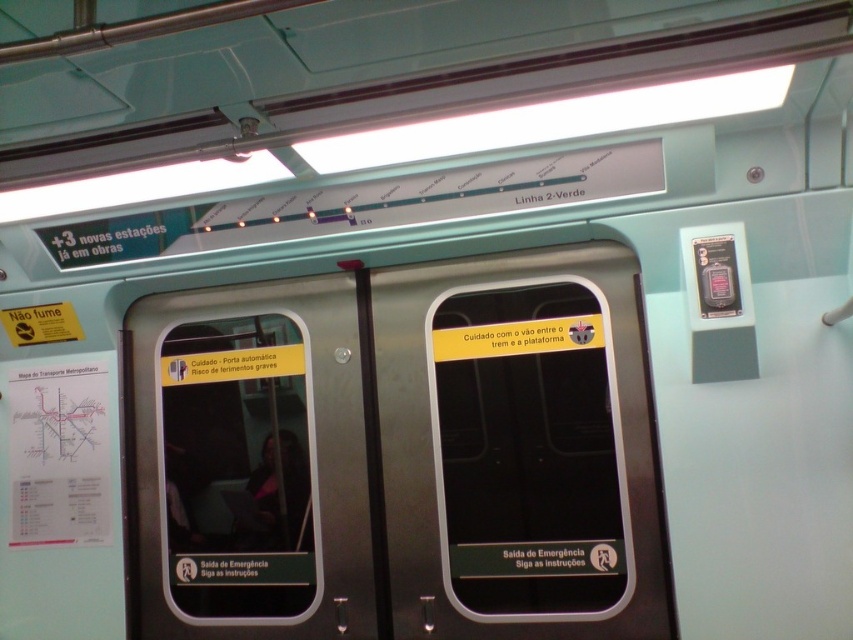
Question: Where is metallic silver emergency exit door at center located in relation to metallic silver door at center in the image?

Choices:
 (A) right
 (B) left

Answer: (A)

Question: Does metallic silver emergency exit door at center appear on the left side of metallic silver door at center?

Choices:
 (A) yes
 (B) no

Answer: (B)

Question: Among these points, which one is nearest to the camera?

Choices:
 (A) (601, 465)
 (B) (155, 492)

Answer: (A)

Question: Which point is closer to the camera?

Choices:
 (A) (306, 592)
 (B) (456, 456)

Answer: (B)

Question: Is metallic silver emergency exit door at center closer to the viewer compared to metallic silver door at center?

Choices:
 (A) no
 (B) yes

Answer: (B)